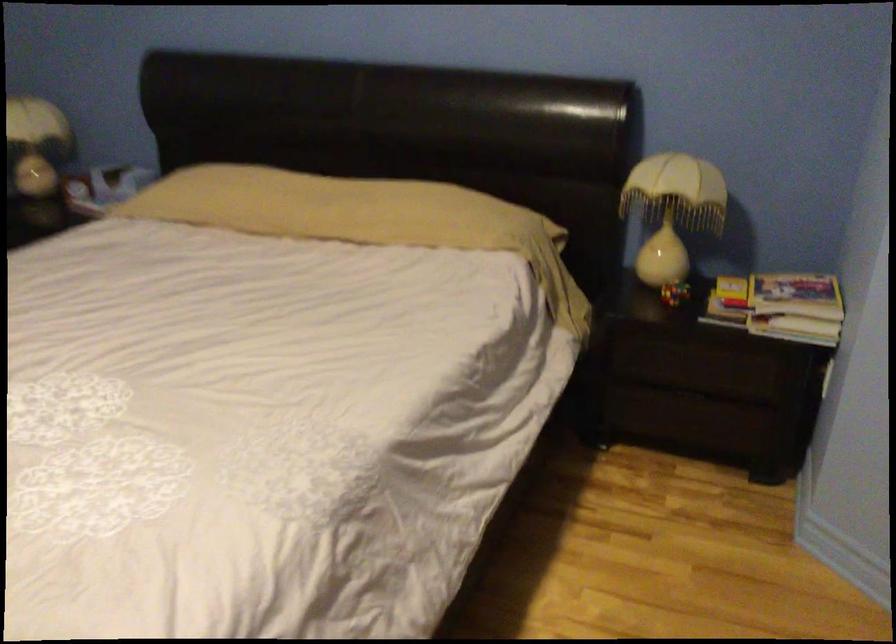
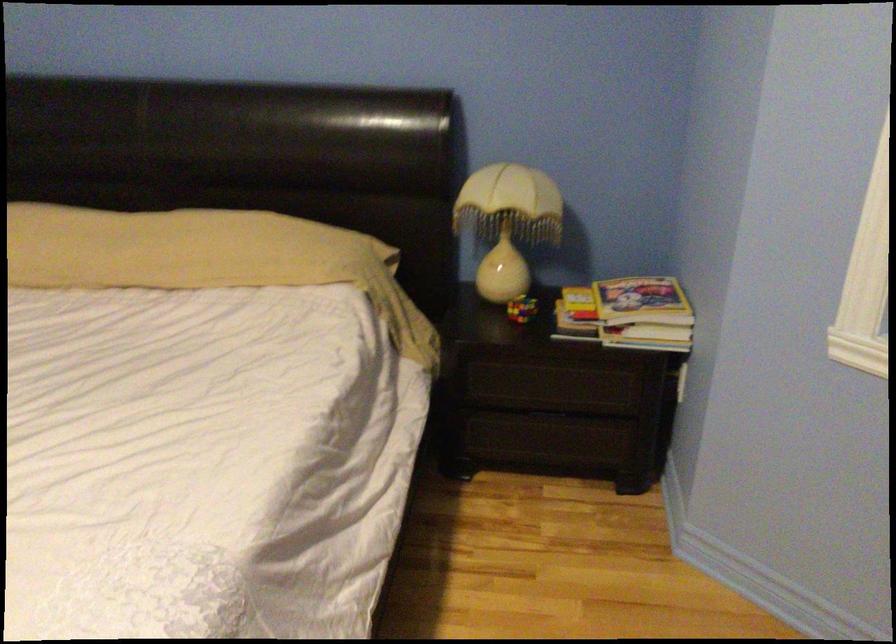
Find the pixel in the second image that matches the point at 798,292 in the first image.

(642, 301)